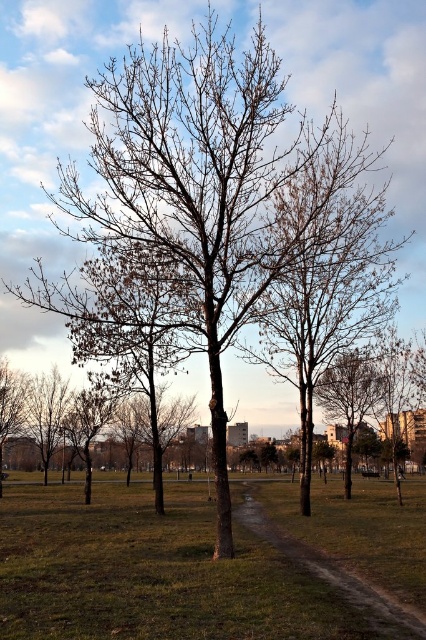
You are a gardener who wants to mow the green grass at center and the grassy dirt path at center. Which area requires a taller mower blade setting to accommodate its height?

The green grass at center requires a taller mower blade setting because it has a greater height compared to the grassy dirt path at center.